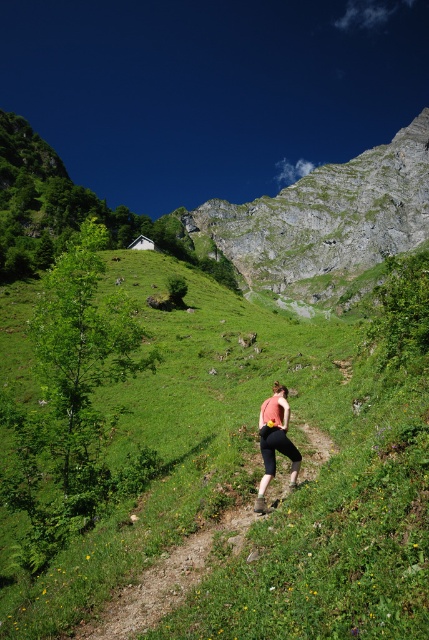
Question: Can you confirm if rugged stone mountain at upper center is wider than brown dirt path at center?

Choices:
 (A) yes
 (B) no

Answer: (A)

Question: Observing the image, what is the correct spatial positioning of green grassy at center in reference to matte pink tank top at center?

Choices:
 (A) left
 (B) right

Answer: (A)

Question: Can you confirm if brown dirt path at center is smaller than matte pink tank top at center?

Choices:
 (A) yes
 (B) no

Answer: (B)

Question: Which point is farther to the camera?

Choices:
 (A) rugged stone mountain at upper center
 (B) green grassy at center
 (C) matte pink tank top at center
 (D) brown dirt path at center

Answer: (A)

Question: Which of the following is the farthest from the observer?

Choices:
 (A) [115, 637]
 (B) [316, 257]

Answer: (B)

Question: Among these objects, which one is farthest from the camera?

Choices:
 (A) green grassy at center
 (B) rugged stone mountain at upper center

Answer: (B)